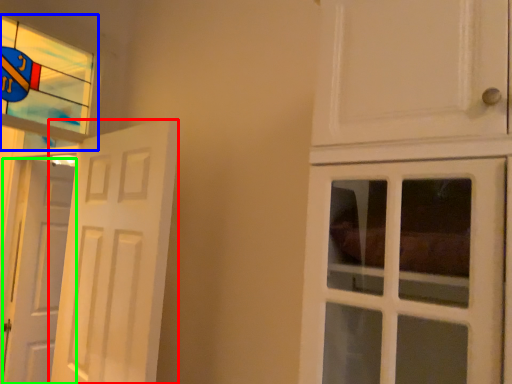
Question: Which object is the farthest from door (highlighted by a red box)? Choose among these: window (highlighted by a blue box) or door (highlighted by a green box).

Choices:
 (A) window
 (B) door

Answer: (B)